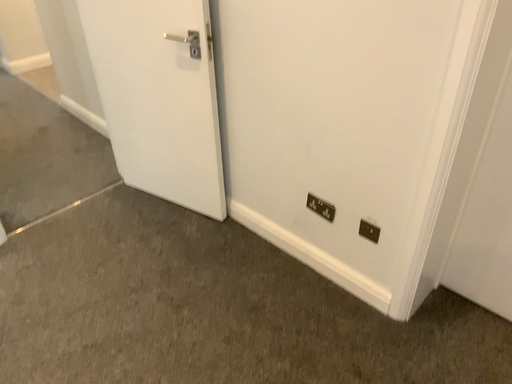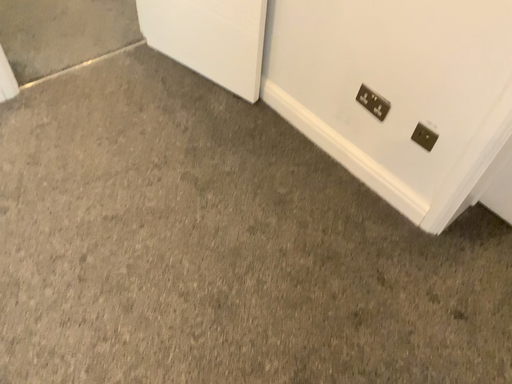
Question: How did the camera likely rotate when shooting the video?

Choices:
 (A) rotated upward
 (B) rotated downward

Answer: (B)